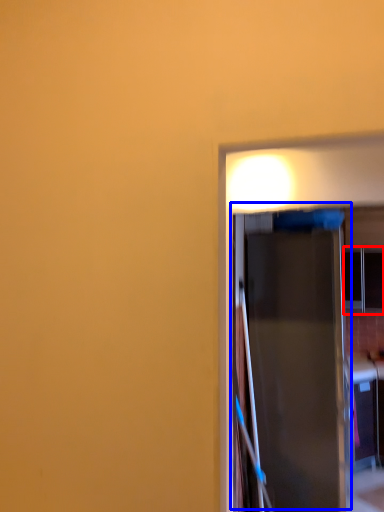
Question: Which object is further to the camera taking this photo, window (highlighted by a red box) or door (highlighted by a blue box)?

Choices:
 (A) window
 (B) door

Answer: (A)